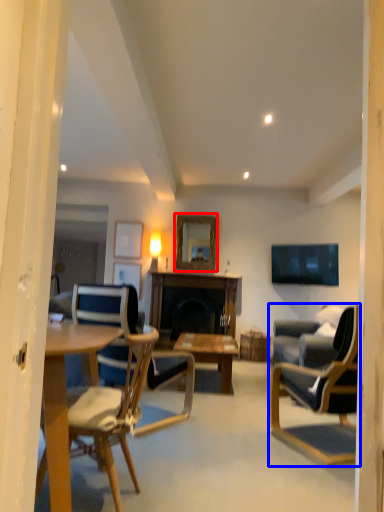
Question: Which of the following is the closest to the observer, mirror (highlighted by a red box) or chair (highlighted by a blue box)?

Choices:
 (A) mirror
 (B) chair

Answer: (B)